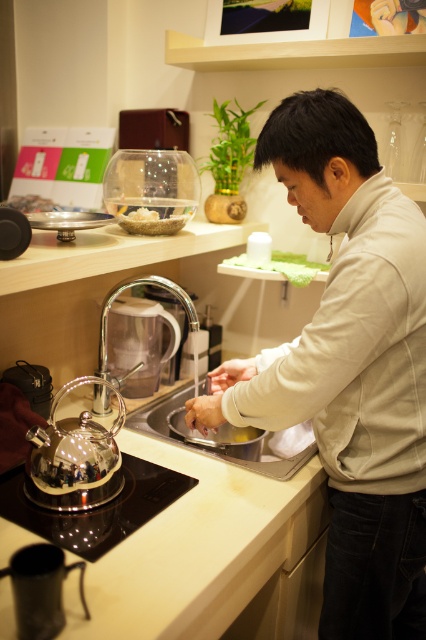
You are a home inspector evaluating the kitchen layout. You notice the black glass stove at lower left and the polished chrome faucet at sink left. Which object is shorter in height?

The black glass stove at lower left has a lesser height compared to the polished chrome faucet at sink left, so the black glass stove at lower left is shorter.

You are a kitchen designer planning to install a new faucet. The current faucet is located at point (158, 417) which marks white glossy sink at center. Where should the new faucet be placed to ensure it is 10 cm to the left of the existing one?

The new faucet should be placed 10 cm to the left of the existing faucet at point (158, 417) which marks white glossy sink at center.

In the kitchen scene, you need to place a new dish rack between the white glossy sink at center and the white matte bowl at upper left. Which object should you position closer to the edge of the counter to ensure the dish rack fits properly?

The white glossy sink at center is wider than the white matte bowl at upper left, so you should position the white glossy sink at center closer to the edge of the counter to accommodate the dish rack between them.